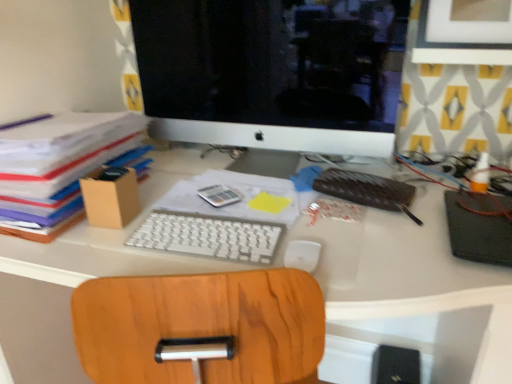
Question: Considering their positions, is white plastic keyboard at center located in front of or behind black matte notebook at right, acting as the 1th notebook starting from the right?

Choices:
 (A) front
 (B) behind

Answer: (B)

Question: From their relative heights in the image, would you say white plastic keyboard at center is taller or shorter than black matte notebook at right, acting as the 1th notebook starting from the right?

Choices:
 (A) short
 (B) tall

Answer: (A)

Question: Estimate the real-world distances between objects in this image. Which object is closer to the leather-bound notebook at center-right, the 1th notebook in the left-to-right sequence?

Choices:
 (A) white glossy computer monitor at upper center
 (B) white plastic keyboard at center
 (C) white matte mouse at center
 (D) black matte notebook at right, which ranks as the second notebook in left-to-right order
 (E) white plastic keyboard at center

Answer: (D)

Question: Estimate the real-world distances between objects in this image. Which object is closer to the white plastic keyboard at center?

Choices:
 (A) black matte notebook at right, acting as the 1th notebook starting from the right
 (B) brown cardboard box at left
 (C) white matte mouse at center
 (D) white glossy computer monitor at upper center
 (E) leather-bound notebook at center-right, the second notebook from the right

Answer: (C)